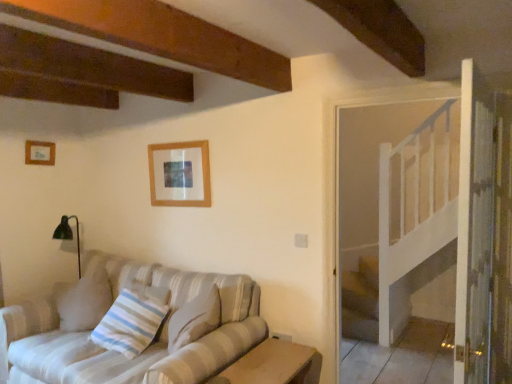
Question: Which direction should I rotate to face wooden picture frame at upper center, positioned as the 2th picture frame in left-to-right order, — up or down?

Choices:
 (A) up
 (B) down

Answer: (A)

Question: From a real-world perspective, is striped fabric pillow at lower left located beneath wooden picture frame at upper center, arranged as the 2th picture frame when viewed from the back?

Choices:
 (A) no
 (B) yes

Answer: (B)

Question: Is striped fabric pillow at lower left looking in the opposite direction of wooden picture frame at upper center, arranged as the 1th picture frame when viewed from the right?

Choices:
 (A) no
 (B) yes

Answer: (A)

Question: Is striped fabric pillow at lower left far from wooden picture frame at upper center, positioned as the first picture frame in front-to-back order?

Choices:
 (A) yes
 (B) no

Answer: (B)

Question: Would you say wooden picture frame at upper center, arranged as the 1th picture frame when viewed from the right, is part of striped fabric pillow at lower left's contents?

Choices:
 (A) yes
 (B) no

Answer: (B)

Question: Does striped fabric pillow at lower left have a lesser width compared to wooden picture frame at upper center, positioned as the first picture frame in front-to-back order?

Choices:
 (A) no
 (B) yes

Answer: (A)

Question: From a real-world perspective, is striped fabric pillow at lower left positioned over wooden picture frame at upper center, positioned as the 2th picture frame in left-to-right order, based on gravity?

Choices:
 (A) yes
 (B) no

Answer: (B)

Question: Considering the relative sizes of wooden table at lower center and wooden picture frame at upper left, the 1th picture frame viewed from the left, in the image provided, is wooden table at lower center bigger than wooden picture frame at upper left, the 1th picture frame viewed from the left,?

Choices:
 (A) no
 (B) yes

Answer: (B)

Question: From the image's perspective, is wooden table at lower center on wooden picture frame at upper left, the 1th picture frame viewed from the left?

Choices:
 (A) no
 (B) yes

Answer: (A)

Question: From a real-world perspective, is wooden table at lower center below wooden picture frame at upper left, the second picture frame when ordered from right to left?

Choices:
 (A) no
 (B) yes

Answer: (B)

Question: Is wooden table at lower center positioned beyond the bounds of wooden picture frame at upper left, the second picture frame when ordered from right to left?

Choices:
 (A) no
 (B) yes

Answer: (B)

Question: Is wooden table at lower center at the right side of wooden picture frame at upper left, the second picture frame when ordered from right to left?

Choices:
 (A) yes
 (B) no

Answer: (A)

Question: Considering the relative sizes of wooden table at lower center and wooden picture frame at upper left, the second picture frame when ordered from right to left, in the image provided, is wooden table at lower center smaller than wooden picture frame at upper left, the second picture frame when ordered from right to left,?

Choices:
 (A) no
 (B) yes

Answer: (A)

Question: From a real-world perspective, is wooden picture frame at upper center, arranged as the 1th picture frame when viewed from the right, on top of wooden table at lower center?

Choices:
 (A) no
 (B) yes

Answer: (B)